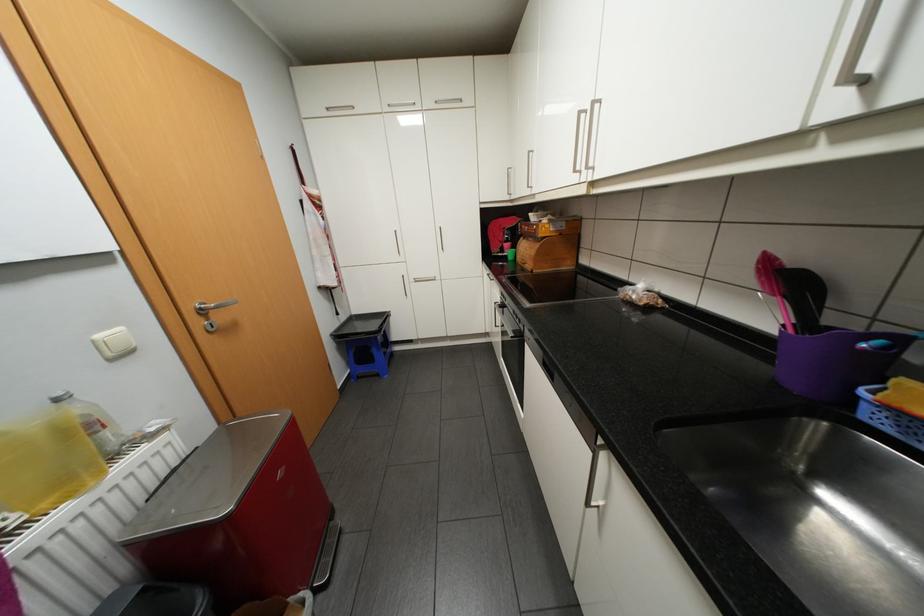
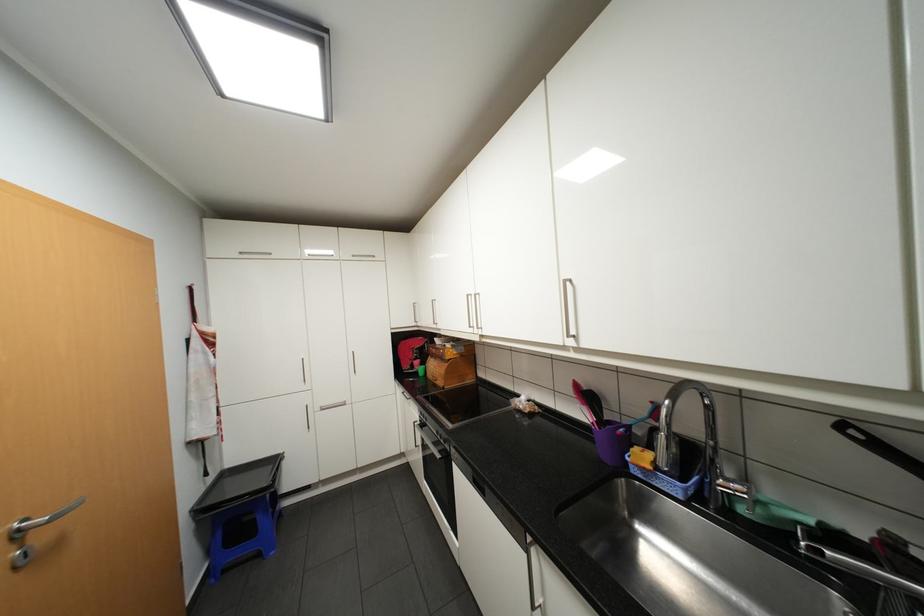
Locate, in the second image, the point that corresponds to (505,193) in the first image.

(412, 322)